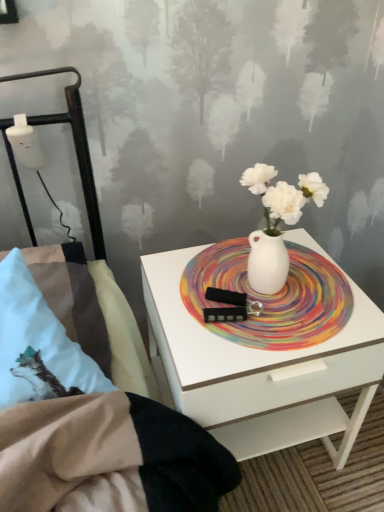
Measure the distance between point (39, 162) and camera.

The depth of point (39, 162) is 1.04 meters.

Where is `rainbow painted platter at center`? The image size is (384, 512). rainbow painted platter at center is located at coordinates (271, 297).

What is the approximate width of white glossy nightstand at center?

It is 17.04 inches.

Find the location of a particular element. This screenshot has height=512, width=384. white plastic bottle at left is located at coordinates (25, 143).

Consider the image. Is white plastic bottle at left looking in the opposite direction of rainbow painted platter at center?

No, white plastic bottle at left is not facing away from rainbow painted platter at center.

From the picture: Which is further, (11, 143) or (334, 326)?

The point (11, 143) is farther.

What's the angular difference between white plastic bottle at left and rainbow painted platter at center's facing directions?

They differ by 7.39 degrees in their facing directions.

Can you tell me how much white glossy nightstand at center and white plastic bottle at left differ in facing direction?

7.39 degrees separate the facing orientations of white glossy nightstand at center and white plastic bottle at left.

How distant is white glossy nightstand at center from white plastic bottle at left?

27.08 inches.

In terms of height, does white glossy nightstand at center look taller or shorter compared to white plastic bottle at left?

In the image, white glossy nightstand at center appears to be taller than white plastic bottle at left.

Is white glossy nightstand at center to the left of white plastic bottle at left from the viewer's perspective?

No.

From a real-world perspective, is white plastic bottle at left located higher than white glossy nightstand at center?

Yes, from a real-world perspective, white plastic bottle at left is on top of white glossy nightstand at center.

Which of these two, white plastic bottle at left or white glossy nightstand at center, stands taller?

Standing taller between the two is white glossy nightstand at center.

How many degrees apart are the facing directions of white plastic bottle at left and white glossy nightstand at center?

They differ by 7.39 degrees in their facing directions.

Can you see white glossy nightstand at center touching rainbow painted platter at center?

There is a gap between white glossy nightstand at center and rainbow painted platter at center.

In the image, is white glossy nightstand at center positioned in front of or behind rainbow painted platter at center?

Clearly, white glossy nightstand at center is in front of rainbow painted platter at center.

Between white glossy nightstand at center and rainbow painted platter at center, which one has larger width?

white glossy nightstand at center.

Does rainbow painted platter at center have a lesser width compared to white plastic bottle at left?

No, rainbow painted platter at center is not thinner than white plastic bottle at left.

From a real-world perspective, is rainbow painted platter at center physically located above or below white plastic bottle at left?

From a real-world perspective, rainbow painted platter at center is physically below white plastic bottle at left.

Considering the positions of point (325, 331) and point (25, 143), is point (325, 331) closer or farther from the camera than point (25, 143)?

Point (325, 331) is closer to the camera than point (25, 143).

Considering the relative positions of rainbow painted platter at center and white plastic bottle at left in the image provided, is rainbow painted platter at center in front of white plastic bottle at left?

Yes.

Which is nearer, (239,251) or (190,344)?

Point (239,251) appears to be farther away from the viewer than point (190,344).

Is rainbow painted platter at center positioned before white glossy nightstand at center?

No.

From the image's perspective, is rainbow painted platter at center located beneath white glossy nightstand at center?

Actually, rainbow painted platter at center appears above white glossy nightstand at center in the image.

Locate an element on the screen. The width and height of the screenshot is (384, 512). table lamp above the rainbow painted platter at center (from the image's perspective) is located at coordinates (25, 143).

Locate an element on the screen. The width and height of the screenshot is (384, 512). nightstand on the right of the white plastic bottle at left is located at coordinates (259, 372).

When comparing their distances from rainbow painted platter at center, does white plastic bottle at left or white glossy nightstand at center seem further?

Among the two, white plastic bottle at left is located further to rainbow painted platter at center.

Which object lies further to the anchor point rainbow painted platter at center, white glossy nightstand at center or white plastic bottle at left?

white plastic bottle at left lies further to rainbow painted platter at center than the other object.

Estimate the real-world distances between objects in this image. Which object is closer to white plastic bottle at left, white glossy nightstand at center or rainbow painted platter at center?

rainbow painted platter at center.

Consider the image. Looking at the image, which one is located closer to white glossy nightstand at center, rainbow painted platter at center or white plastic bottle at left?

Among the two, rainbow painted platter at center is located nearer to white glossy nightstand at center.

Estimate the real-world distances between objects in this image. Which object is further from white plastic bottle at left, rainbow painted platter at center or white glossy nightstand at center?

Based on the image, white glossy nightstand at center appears to be further to white plastic bottle at left.

From the image, which object appears to be farther from white glossy nightstand at center, white plastic bottle at left or rainbow painted platter at center?

white plastic bottle at left.

Image resolution: width=384 pixels, height=512 pixels. What are the coordinates of `nightstand situated between white plastic bottle at left and rainbow painted platter at center from left to right` in the screenshot? It's located at (259, 372).